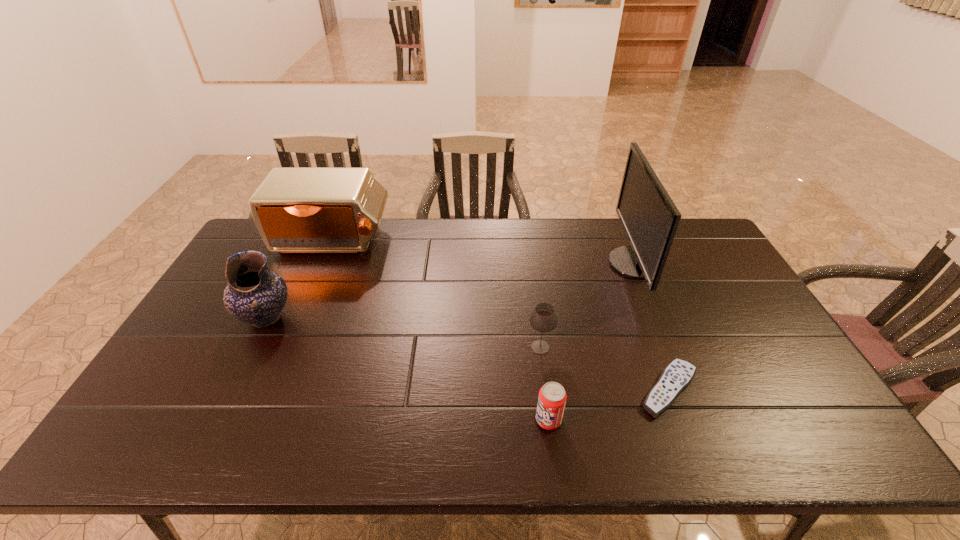
Locate an element on the screen. free space between the tallest object and the wineglass is located at coordinates (588, 305).

What are the coordinates of `free spot between the toaster oven and the shortest object` in the screenshot? It's located at click(x=501, y=316).

Where is `vacant area between the toaster oven and the fourth tallest object`? Image resolution: width=960 pixels, height=540 pixels. vacant area between the toaster oven and the fourth tallest object is located at coordinates (436, 294).

Find the location of a particular element. This screenshot has height=540, width=960. free space between the wineglass and the soda can is located at coordinates click(544, 383).

The height and width of the screenshot is (540, 960). What are the coordinates of `vacant space in between the tallest object and the pottery` in the screenshot? It's located at coord(450,291).

Locate an element on the screen. Image resolution: width=960 pixels, height=540 pixels. empty space that is in between the shortest object and the toaster oven is located at coordinates (501, 316).

Identify which object is located as the second nearest to the pottery. Please provide its 2D coordinates. Your answer should be formatted as a tuple, i.e. [(x, y)], where the tuple contains the x and y coordinates of a point satisfying the conditions above.

[(543, 318)]

Where is `object that is the fifth closest to the third shortest object`? Image resolution: width=960 pixels, height=540 pixels. object that is the fifth closest to the third shortest object is located at coordinates (255, 295).

Where is `vacant space that satisfies the following two spatial constraints: 1. on the door side of the wineglass; 2. on the right side of the toaster oven`? The image size is (960, 540). vacant space that satisfies the following two spatial constraints: 1. on the door side of the wineglass; 2. on the right side of the toaster oven is located at coordinates (288, 347).

Where is `free spot that satisfies the following two spatial constraints: 1. on the door side of the toaster oven; 2. on the right side of the wineglass`? Image resolution: width=960 pixels, height=540 pixels. free spot that satisfies the following two spatial constraints: 1. on the door side of the toaster oven; 2. on the right side of the wineglass is located at coordinates (288, 347).